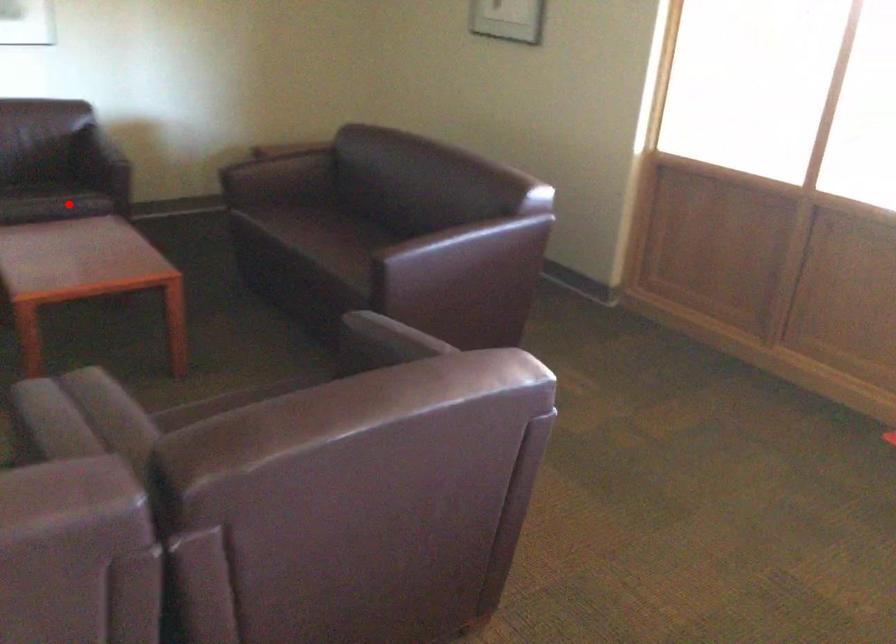
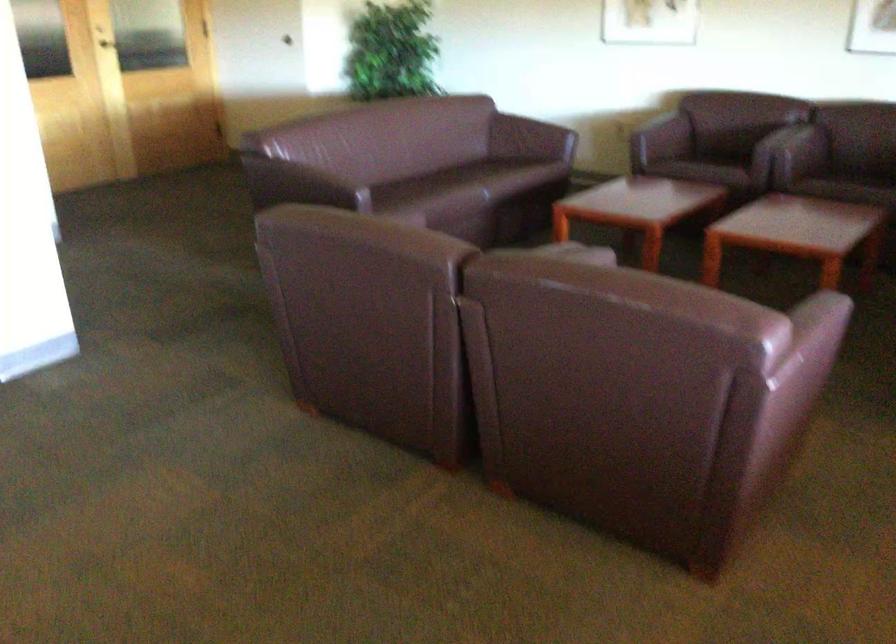
Locate, in the second image, the point that corresponds to the highlighted location in the first image.

(853, 185)